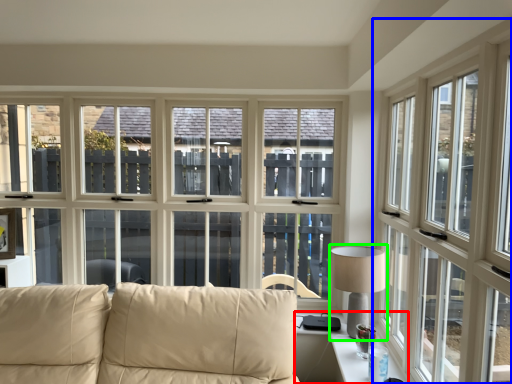
Question: Which object is positioned closest to table (highlighted by a red box)? Select from window (highlighted by a blue box) and table lamp (highlighted by a green box).

Choices:
 (A) window
 (B) table lamp

Answer: (B)